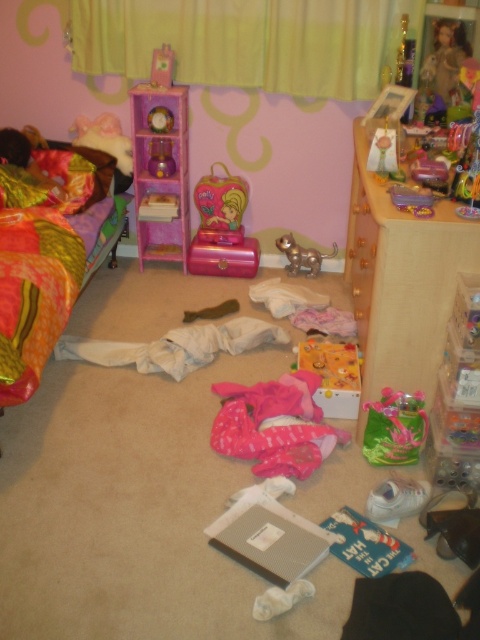
Is wooden at right closer to camera compared to matte purple clock at center?

That is True.

Can you confirm if wooden at right is smaller than matte purple clock at center?

No, wooden at right is not smaller than matte purple clock at center.

Does point (372, 326) come closer to viewer compared to point (147, 166)?

Yes, point (372, 326) is closer to viewer.

Locate an element on the screen. The image size is (480, 640). wooden at right is located at coordinates (400, 282).

Is shiny green plastic toy at center above matte purple clock at center?

No, shiny green plastic toy at center is not above matte purple clock at center.

Between shiny green plastic toy at center and matte purple clock at center, which one has less height?

matte purple clock at center

The image size is (480, 640). What are the coordinates of `shiny green plastic toy at center` in the screenshot? It's located at (395, 428).

The height and width of the screenshot is (640, 480). I want to click on yellow fabric curtain at upper center, so click(248, 42).

Does point (352, 28) come in front of point (333, 243)?

Yes, point (352, 28) is in front of point (333, 243).

Locate an element on the screen. yellow fabric curtain at upper center is located at coordinates (248, 42).